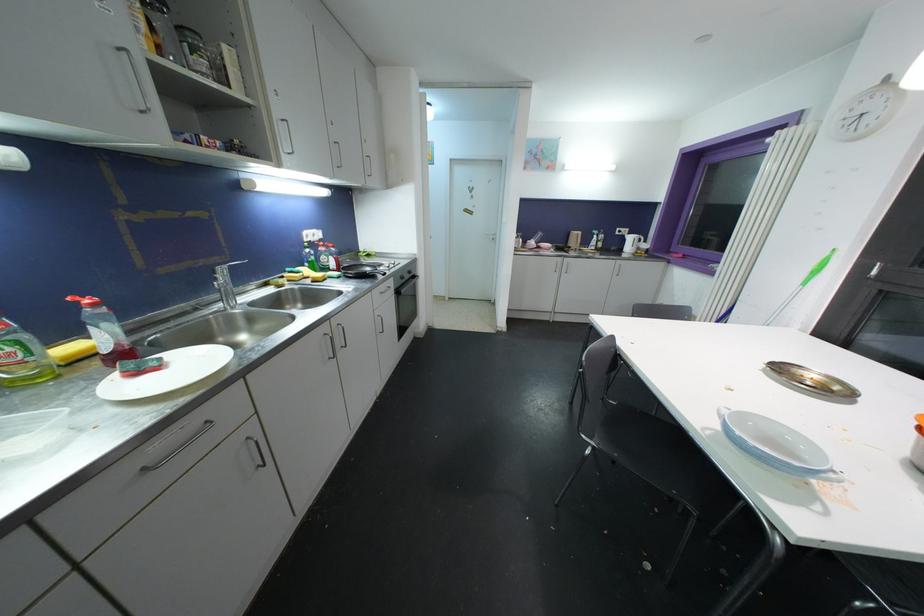
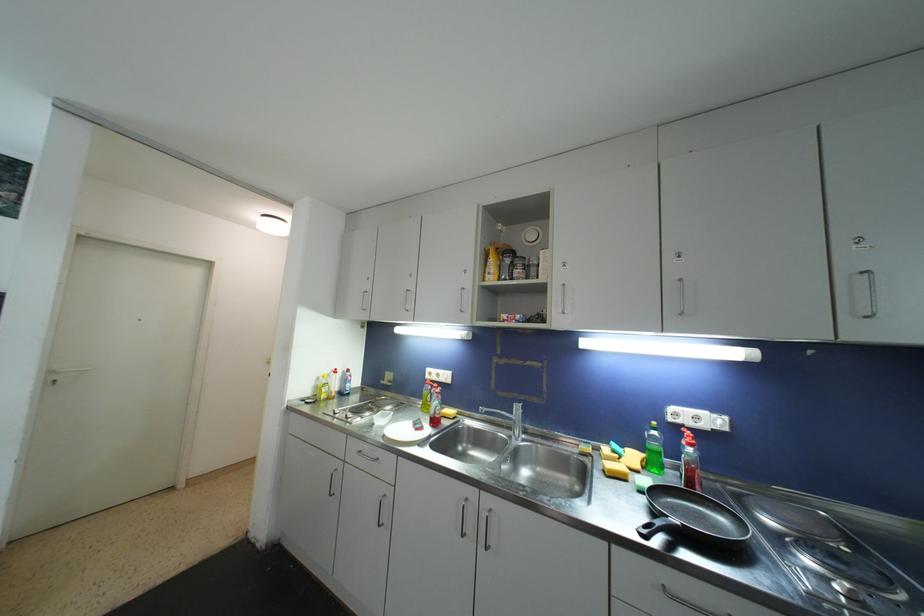
In the second image, find the point that corresponds to [310,253] in the first image.

(658, 436)